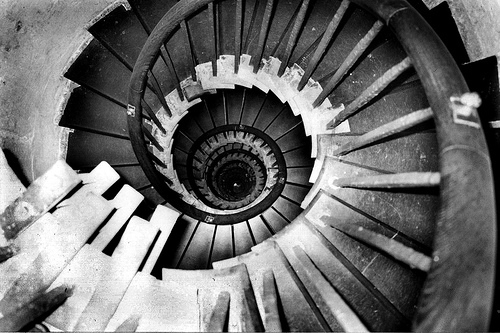
Find the location of a particular element. Image resolution: width=500 pixels, height=333 pixels. handrail support poles is located at coordinates (398, 252), (401, 180), (327, 35), (188, 42), (150, 133), (269, 295), (218, 308), (36, 304).